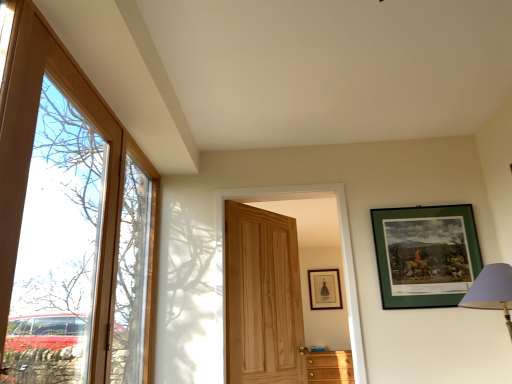
Question: Is wooden cabinet at lower right completely or partially inside green matte picture frame at upper right, arranged as the 1th picture frame when viewed from the front?

Choices:
 (A) yes
 (B) no

Answer: (B)

Question: Is green matte picture frame at upper right, arranged as the 1th picture frame when viewed from the front, thinner than wooden cabinet at lower right?

Choices:
 (A) yes
 (B) no

Answer: (A)

Question: From a real-world perspective, is green matte picture frame at upper right, arranged as the 1th picture frame when viewed from the front, physically above wooden cabinet at lower right?

Choices:
 (A) no
 (B) yes

Answer: (B)

Question: Can you confirm if green matte picture frame at upper right, marked as the 2th picture frame in a back-to-front arrangement, is shorter than wooden cabinet at lower right?

Choices:
 (A) no
 (B) yes

Answer: (A)

Question: Is green matte picture frame at upper right, which appears as the 1th picture frame when viewed from the top, positioned before wooden cabinet at lower right?

Choices:
 (A) yes
 (B) no

Answer: (A)

Question: From the image's perspective, relative to green matte picture frame at upper right, marked as the 2th picture frame in a back-to-front arrangement, is wooden cabinet at lower right above or below?

Choices:
 (A) above
 (B) below

Answer: (B)

Question: Does point (318, 362) appear closer or farther from the camera than point (434, 225)?

Choices:
 (A) farther
 (B) closer

Answer: (A)

Question: In the image, is wooden cabinet at lower right on the left side or the right side of green matte picture frame at upper right, marked as the 2th picture frame in a back-to-front arrangement?

Choices:
 (A) left
 (B) right

Answer: (A)

Question: Based on their sizes in the image, would you say wooden cabinet at lower right is bigger or smaller than green matte picture frame at upper right, arranged as the 1th picture frame when viewed from the front?

Choices:
 (A) small
 (B) big

Answer: (B)

Question: From the image's perspective, is wooden door at left, the first door viewed from the left, positioned above or below natural wood door at center, the 1th door from the back?

Choices:
 (A) below
 (B) above

Answer: (B)

Question: Is wooden door at left, which ranks as the second door in right-to-left order, inside or outside of natural wood door at center, the 1th door from the back?

Choices:
 (A) inside
 (B) outside

Answer: (B)

Question: In the image, is wooden door at left, the 1th door from the front, positioned in front of or behind natural wood door at center, the 2th door positioned from the front?

Choices:
 (A) behind
 (B) front

Answer: (B)

Question: Considering the positions of wooden door at left, the 1th door from the front, and natural wood door at center, the 2th door positioned from the front, in the image, is wooden door at left, the 1th door from the front, bigger or smaller than natural wood door at center, the 2th door positioned from the front,?

Choices:
 (A) small
 (B) big

Answer: (B)

Question: Looking at their shapes, would you say matte black picture frame at upper center, which ranks as the first picture frame in bottom-to-top order, is wider or thinner than clear glass window at left?

Choices:
 (A) wide
 (B) thin

Answer: (B)

Question: From a real-world perspective, is matte black picture frame at upper center, the second picture frame positioned from the top, above or below clear glass window at left?

Choices:
 (A) below
 (B) above

Answer: (B)